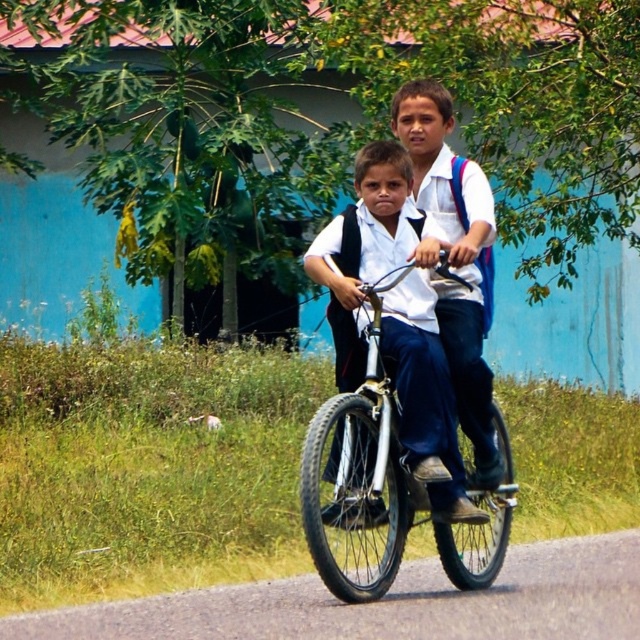
You are a photographer trying to capture the two boys on the bicycle. You need to ensure that both the metallic silver bicycle at center and the white matte shirt at center are fully visible in your shot. Given their widths, which object should you prioritize framing more carefully to avoid cropping?

The metallic silver bicycle at center is wider than the white matte shirt at center. Therefore, you should prioritize framing the metallic silver bicycle at center more carefully to avoid cropping, as it requires more space in the shot.

Based on the scene description, can you determine whether the metallic silver bicycle at center is positioned above or below the white matte shirt at center?

The metallic silver bicycle at center is located below the white matte shirt at center.